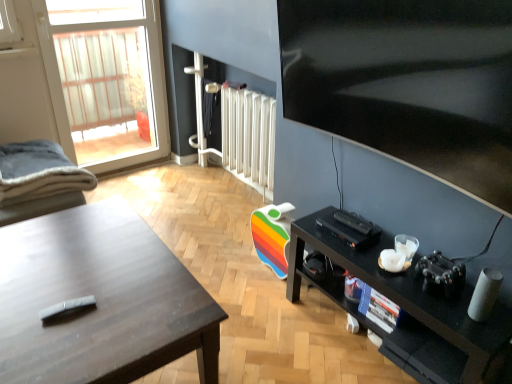
This screenshot has height=384, width=512. Find the location of `empty space that is ontop of black matte shelf at lower right (from a real-world perspective)`. empty space that is ontop of black matte shelf at lower right (from a real-world perspective) is located at coordinates (393, 263).